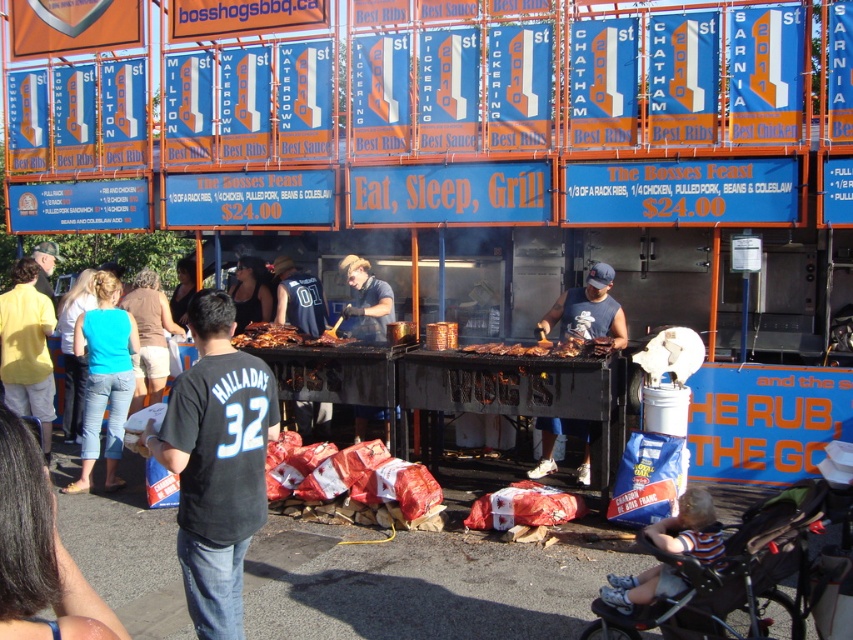
You are standing at the barbecue area and want to reach both the point at coordinates point (x=369, y=275) and point (x=323, y=342). Which point is closer to you?

Point (x=323, y=342) is closer to you because it is less further than point (x=369, y=275).

You are a photographer at the barbecue event. You want to take a photo that includes both the charred wood planks at center and the dark blue jersey at center. Which object should you position closer to the camera to ensure both are in focus?

The charred wood planks at center has a lesser height compared to dark blue jersey at center, so you should position the dark blue jersey at center closer to the camera to ensure both are in focus.